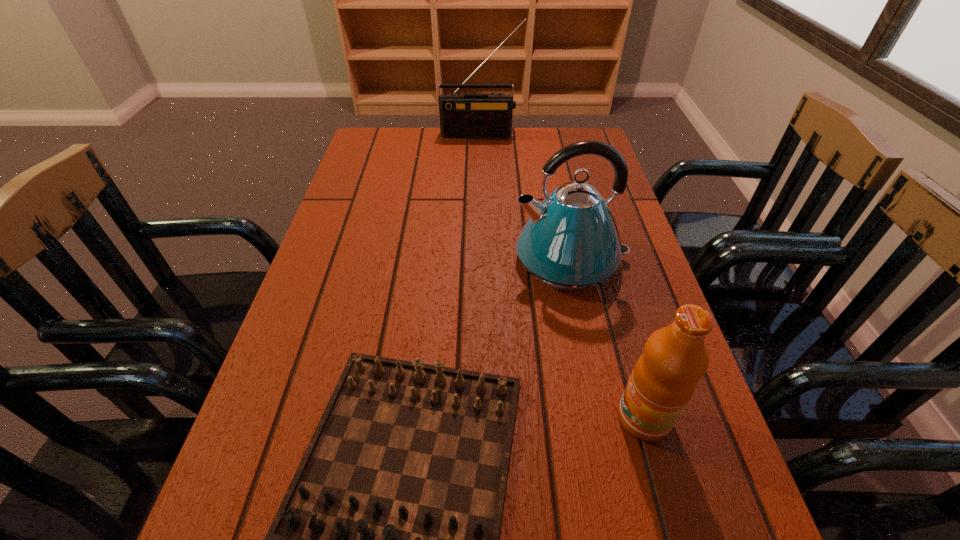
Select which object is the closest to the radio receiver. Please provide its 2D coordinates. Your answer should be formatted as a tuple, i.e. [(x, y)], where the tuple contains the x and y coordinates of a point satisfying the conditions above.

[(571, 242)]

Locate which object ranks second in proximity to the fruit juice. Please provide its 2D coordinates. Your answer should be formatted as a tuple, i.e. [(x, y)], where the tuple contains the x and y coordinates of a point satisfying the conditions above.

[(571, 242)]